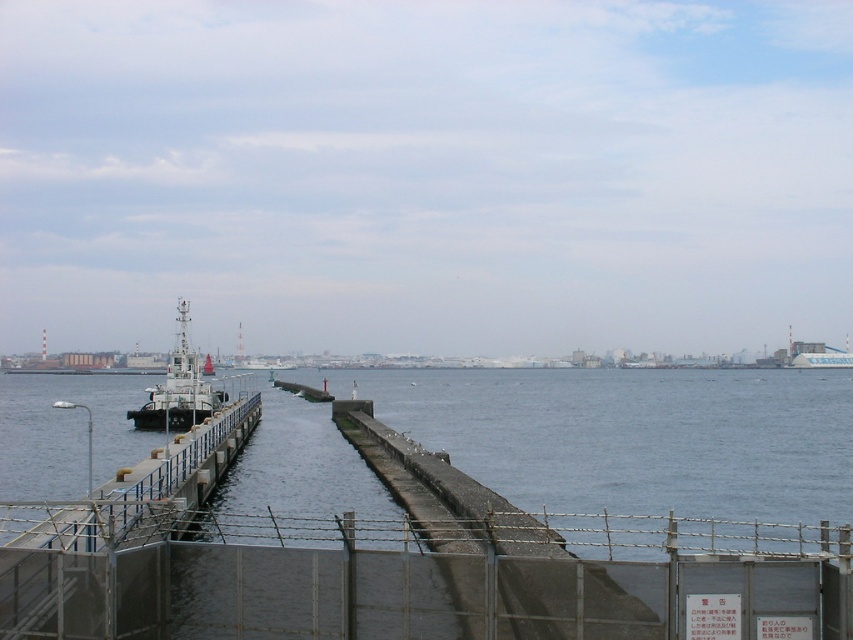
Question: Does metallic chain-link fence at center have a greater width compared to metallic gray ship at center-left?

Choices:
 (A) no
 (B) yes

Answer: (A)

Question: Which point is closer to the camera?

Choices:
 (A) metallic gray ship at center-left
 (B) metallic chain-link fence at center

Answer: (B)

Question: Which point is closer to the camera?

Choices:
 (A) (323, 564)
 (B) (189, 394)

Answer: (A)

Question: Does metallic chain-link fence at center have a greater width compared to metallic gray ship at center-left?

Choices:
 (A) yes
 (B) no

Answer: (B)

Question: Which object appears closest to the camera in this image?

Choices:
 (A) metallic chain-link fence at center
 (B) metallic gray ship at center-left

Answer: (A)

Question: Can you confirm if metallic chain-link fence at center is bigger than metallic gray ship at center-left?

Choices:
 (A) yes
 (B) no

Answer: (B)